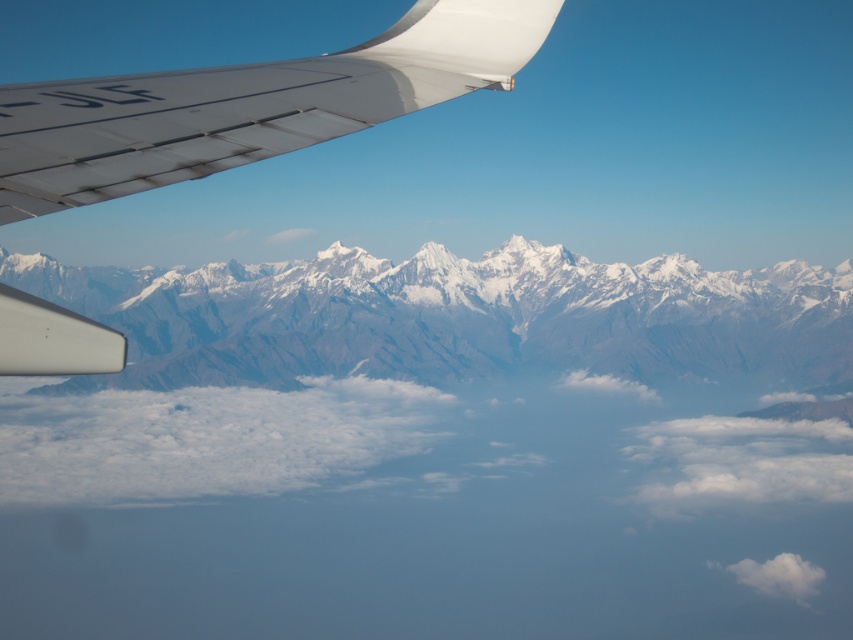
Question: Which point is closer to the camera?

Choices:
 (A) (770, 582)
 (B) (235, 157)

Answer: (B)

Question: Can you confirm if matte white wing at upper left is positioned to the left of white fluffy cloud at lower right?

Choices:
 (A) no
 (B) yes

Answer: (B)

Question: Which point is farther to the camera?

Choices:
 (A) coord(459,353)
 (B) coord(47,179)

Answer: (A)

Question: Is snowy granite mountains at center positioned behind white fluffy cloud at lower right?

Choices:
 (A) yes
 (B) no

Answer: (B)

Question: Does snowy granite mountains at center appear under matte white wing at upper left?

Choices:
 (A) yes
 (B) no

Answer: (A)

Question: Which of the following is the closest to the observer?

Choices:
 (A) snowy granite mountains at center
 (B) white fluffy cloud at lower right
 (C) matte white wing at upper left

Answer: (C)